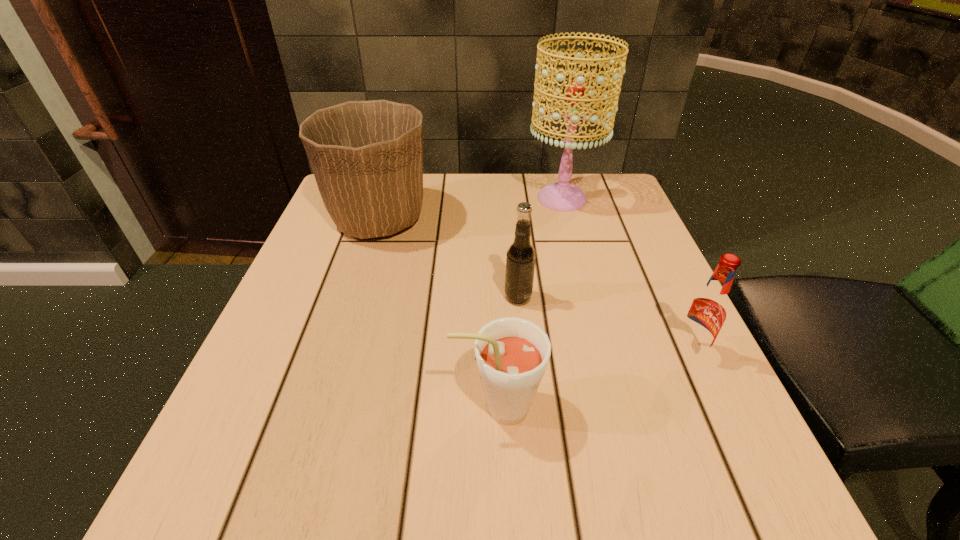
Where is `vacant space at the near right corner of the desktop`? vacant space at the near right corner of the desktop is located at coordinates (707, 502).

Find the location of a particular element. The height and width of the screenshot is (540, 960). unoccupied area between the farthest root beer and the leftmost object is located at coordinates (448, 258).

The width and height of the screenshot is (960, 540). What are the coordinates of `blank region between the third nearest object and the second nearest root beer` in the screenshot? It's located at (603, 325).

The image size is (960, 540). In order to click on free space between the tallest object and the nearest root beer in this screenshot , I will do `click(530, 302)`.

Where is `free space between the fourth shortest object and the lampshade`? Image resolution: width=960 pixels, height=540 pixels. free space between the fourth shortest object and the lampshade is located at coordinates (470, 208).

The width and height of the screenshot is (960, 540). I want to click on vacant space that is in between the nearest root beer and the tallest object, so click(530, 302).

The width and height of the screenshot is (960, 540). What are the coordinates of `free space between the third nearest object and the rightmost root beer` in the screenshot? It's located at (603, 325).

At what (x,y) coordinates should I click in order to perform the action: click on vacant area that lies between the flowerpot and the farthest root beer. Please return your answer as a coordinate pair (x, y). The image size is (960, 540). Looking at the image, I should click on (448, 258).

Locate an element on the screen. This screenshot has width=960, height=540. vacant area that lies between the lampshade and the farthest root beer is located at coordinates (540, 248).

Where is `empty space between the second nearest object and the leftmost object`? The image size is (960, 540). empty space between the second nearest object and the leftmost object is located at coordinates (534, 285).